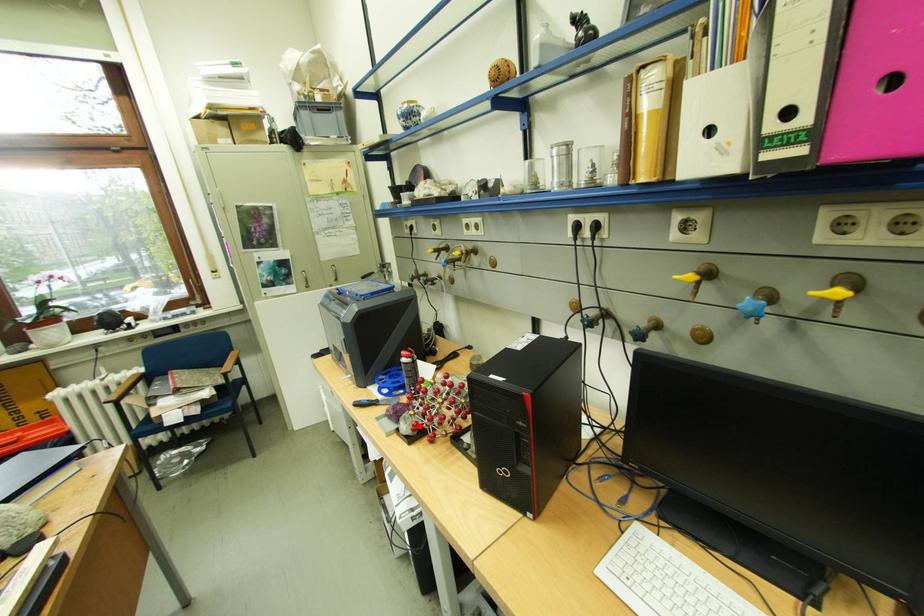
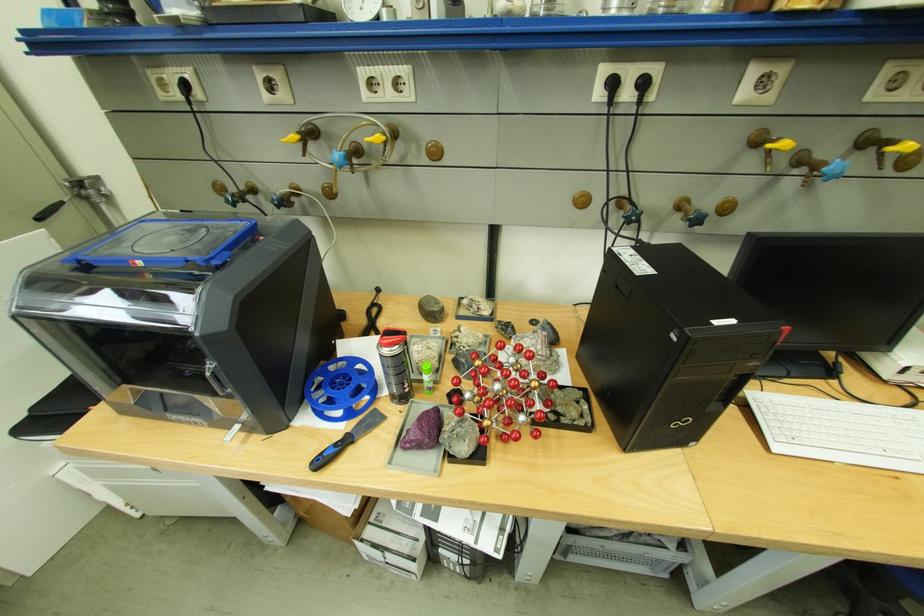
The point at the highlighted location is marked in the first image. Where is the corresponding point in the second image?

(480, 440)